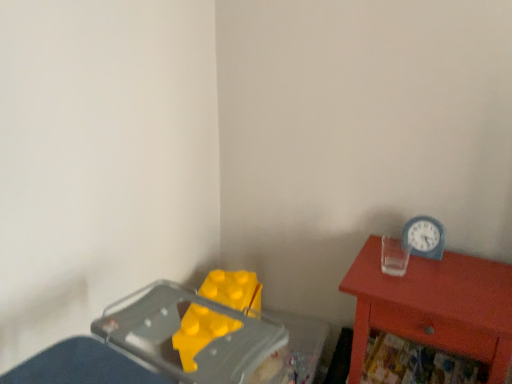
Question: Looking at their shapes, would you say matte red nightstand at right is wider or thinner than blue plastic clock at upper right?

Choices:
 (A) thin
 (B) wide

Answer: (B)

Question: Is matte red nightstand at right bigger or smaller than blue plastic clock at upper right?

Choices:
 (A) small
 (B) big

Answer: (B)

Question: Is point (507, 360) closer or farther from the camera than point (413, 218)?

Choices:
 (A) farther
 (B) closer

Answer: (B)

Question: Is blue plastic clock at upper right in front of or behind matte red nightstand at right in the image?

Choices:
 (A) front
 (B) behind

Answer: (B)

Question: Do you think blue plastic clock at upper right is within matte red nightstand at right, or outside of it?

Choices:
 (A) inside
 (B) outside

Answer: (B)

Question: From a real-world perspective, relative to matte red nightstand at right, is blue plastic clock at upper right vertically above or below?

Choices:
 (A) below
 (B) above

Answer: (B)

Question: In terms of height, does blue plastic clock at upper right look taller or shorter compared to matte red nightstand at right?

Choices:
 (A) tall
 (B) short

Answer: (B)